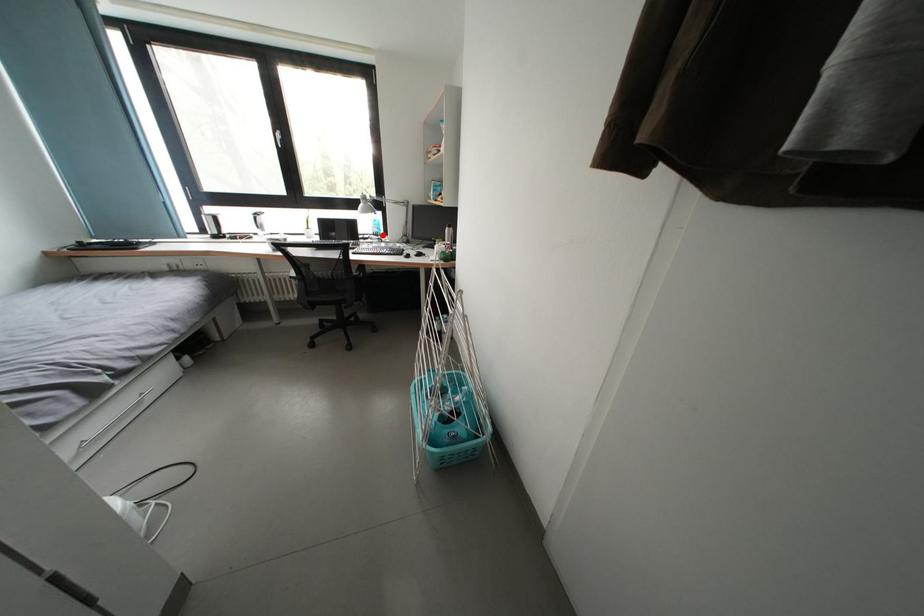
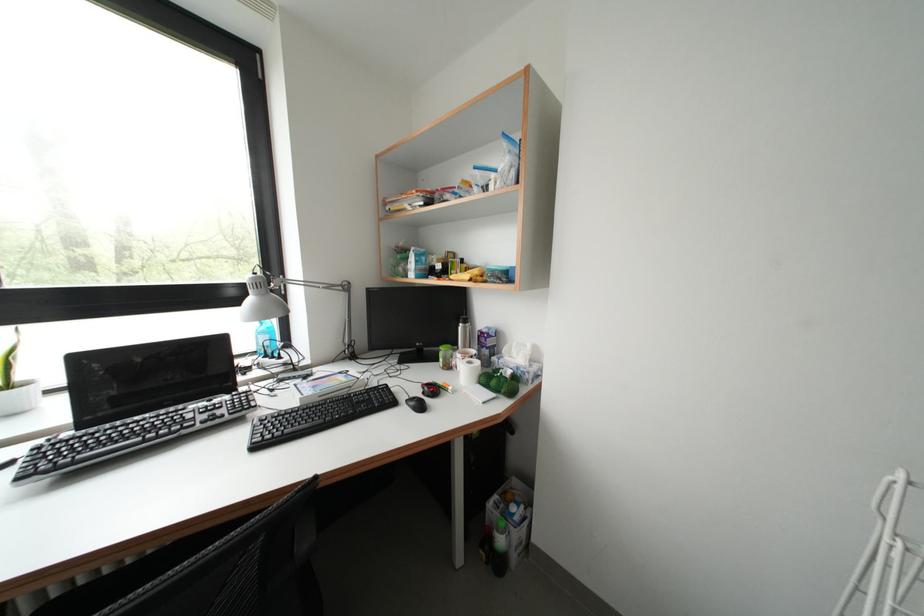
Find the pixel in the second image that matches the highlighted location in the first image.

(274, 347)